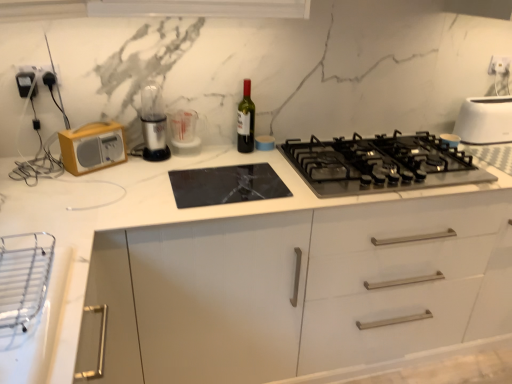
Question: Is black matte gas stove at center bigger or smaller than white plastic electrical outlet at upper right?

Choices:
 (A) big
 (B) small

Answer: (A)

Question: Is black matte gas stove at center in front of or behind white plastic electrical outlet at upper right in the image?

Choices:
 (A) behind
 (B) front

Answer: (B)

Question: Estimate the real-world distances between objects in this image. Which object is closer to the black matte gas stove at center?

Choices:
 (A) white plastic electrical outlet at upper right
 (B) white plastic toaster at upper right
 (C) wooden radio at left
 (D) clear plastic measuring cup at center, arranged as the first appliance when ordered from the bottom
 (E) green glass bottle at center

Answer: (E)

Question: Which object is the closest to the black matte gas stove at center?

Choices:
 (A) clear plastic measuring cup at center, acting as the second appliance starting from the top
 (B) white plastic electrical outlet at upper right
 (C) matte black radio at left, arranged as the first appliance when viewed from the left
 (D) green glass bottle at center
 (E) wooden radio at left

Answer: (D)